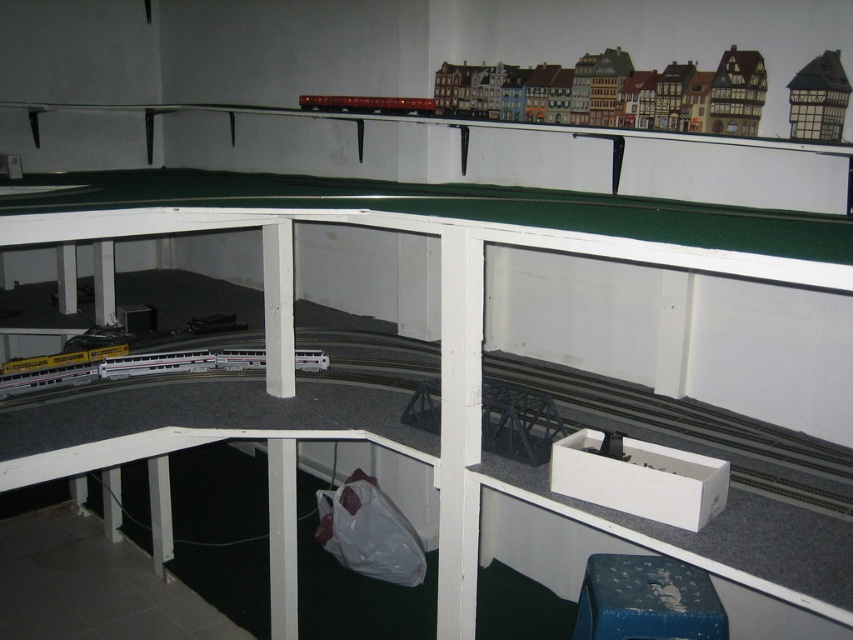
Question: Which object is closer to the camera taking this photo?

Choices:
 (A) wooden house at upper right
 (B) metallic red train at upper center

Answer: (A)

Question: Estimate the real-world distances between objects in this image. Which object is farther from the wooden house at upper right?

Choices:
 (A) white plastic train track at lower left
 (B) metallic red train at upper center

Answer: (B)

Question: Which of these objects is positioned closest to the white plastic train track at lower left?

Choices:
 (A) metallic red train at upper center
 (B) wooden house at upper right

Answer: (B)

Question: From the image, what is the correct spatial relationship of white plastic train track at lower left in relation to metallic red train at upper center?

Choices:
 (A) right
 (B) left

Answer: (A)

Question: Can you confirm if white plastic train track at lower left is wider than wooden house at upper right?

Choices:
 (A) no
 (B) yes

Answer: (B)

Question: Is white plastic train track at lower left behind wooden house at upper right?

Choices:
 (A) no
 (B) yes

Answer: (A)